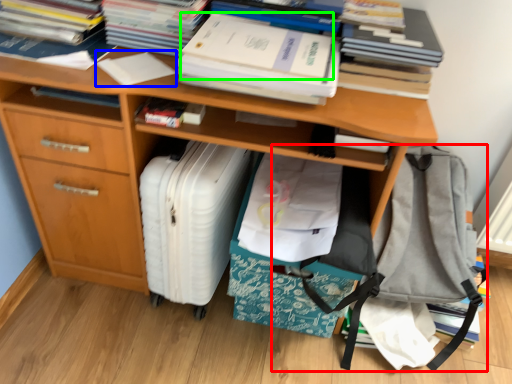
Question: Which is farther away from messenger bag (highlighted by a red box)? book (highlighted by a blue box) or paperback book (highlighted by a green box)?

Choices:
 (A) book
 (B) paperback book

Answer: (A)